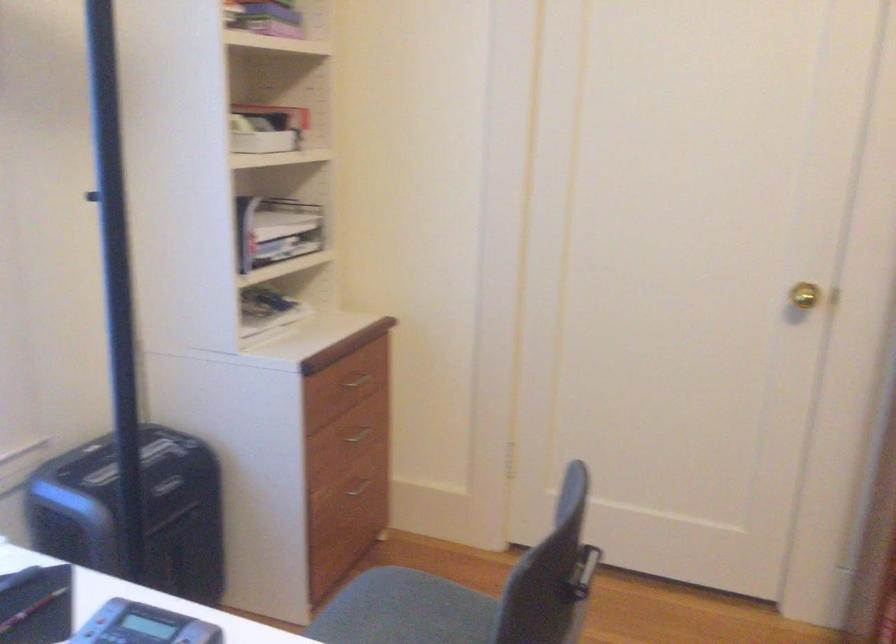
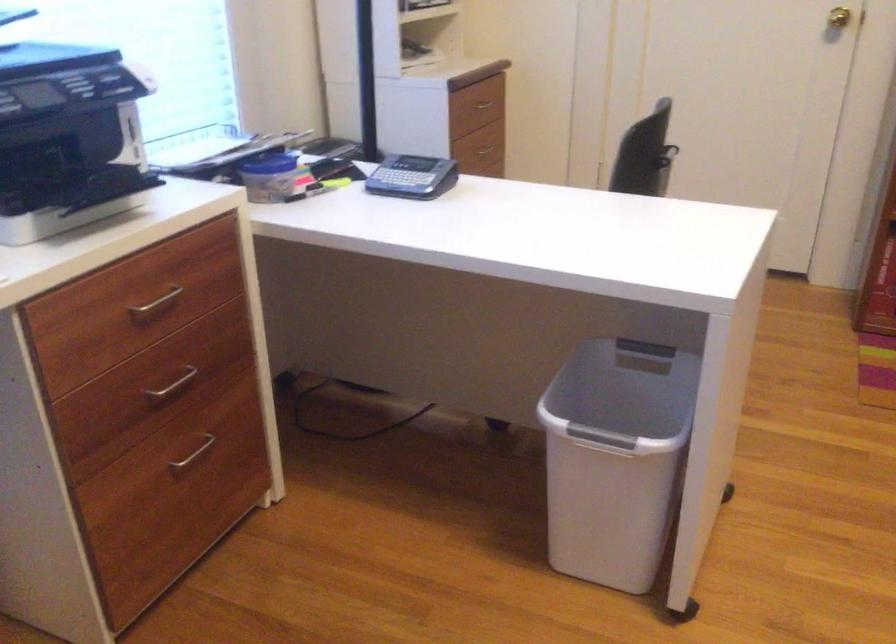
Question: I am providing you with two images of the same scene from different viewpoints. After the viewpoint changes to image2, which objects are now occluded?

Choices:
 (A) black caster wheel
 (B) brass doorknob
 (C) chair sitting surface
 (D) metal paper clip

Answer: (C)